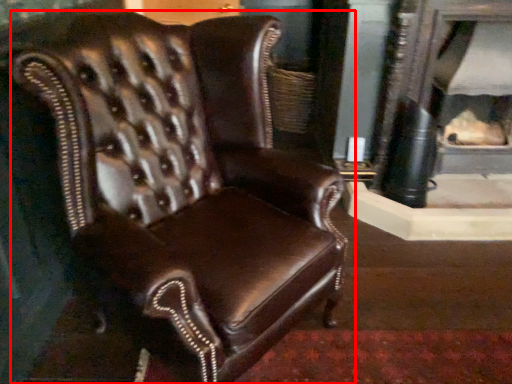
Question: From the image's perspective, what is the correct spatial relationship of chair (annotated by the red box) in relation to fireplace?

Choices:
 (A) below
 (B) above

Answer: (A)